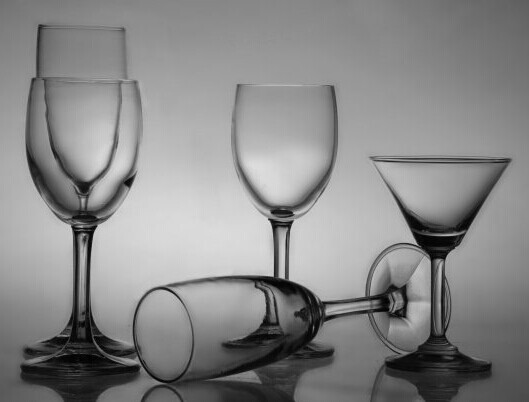
Identify the location of base of glass. This screenshot has height=402, width=529. (446, 368), (418, 293), (314, 348), (94, 369), (57, 346).